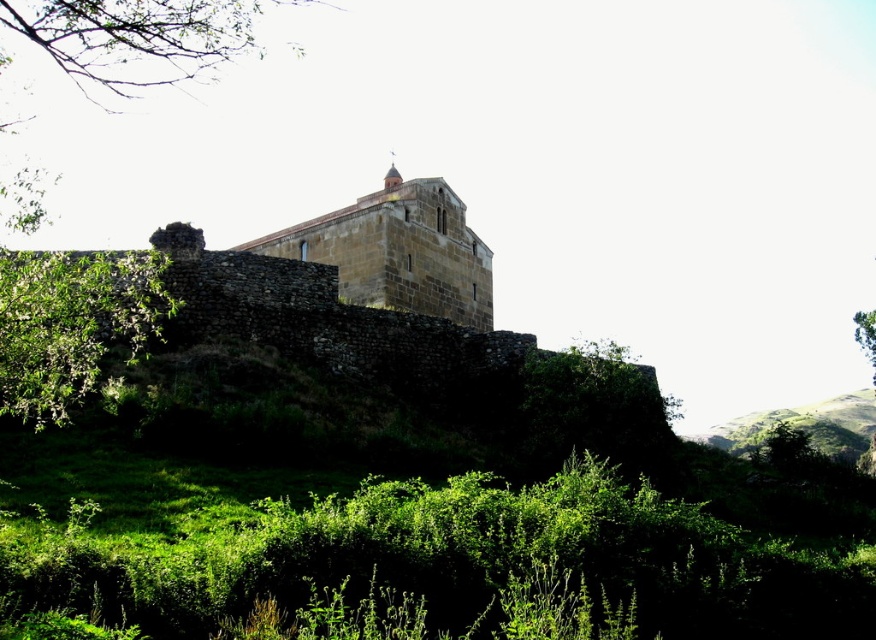
You are standing at the base of the hill where the historic stone structure is located. You want to take a photo of the structure without the green leafy tree at upper left blocking the view. Can you do so from your current position?

The green leafy tree at upper left is 174.74 feet away from the viewer. Since it is at a significant distance, you can likely position yourself to avoid the tree blocking the view of the historic stone structure.

You are standing at the base of the hill in the image and want to take a photo of the historic stone structure. You notice two points marked in the image. Which point, point (220, 54) or point (131, 266), is closer to the historic stone structure?

Point (220, 54) is behind point (131, 266), so the point closer to the historic stone structure is point (131, 266).

You are an architect planning to add a new pathway from the green leafy tree at upper left to the brown stone castle at center. Based on the scene, will the pathway be visible from the castle? Explain your reasoning.

The green leafy tree at upper left is positioned over brown stone castle at center, so the pathway would be partially obscured by the tree, making it less visible from the castle.